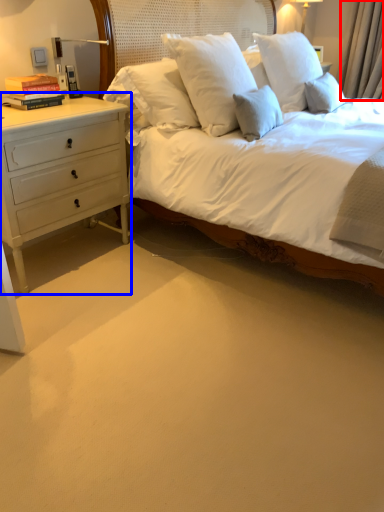
Question: Which point is closer to the camera, curtain (highlighted by a red box) or chest of drawers (highlighted by a blue box)?

Choices:
 (A) curtain
 (B) chest of drawers

Answer: (B)